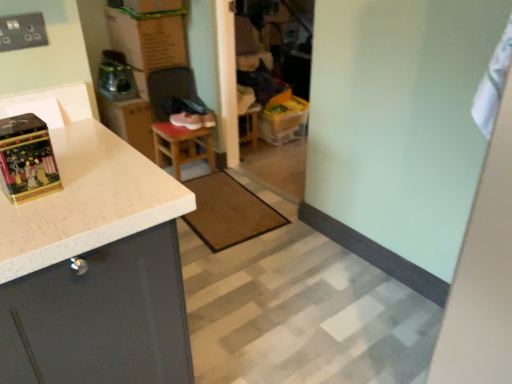
You are a GUI agent. You are given a task and a screenshot of the screen. Output one action in this format:
    pyautogui.click(x=<x>, y=<y>)
    Task: Click on the vacant region to the left of pink suede shoe at center
    
    Given the screenshot: What is the action you would take?
    pyautogui.click(x=168, y=125)